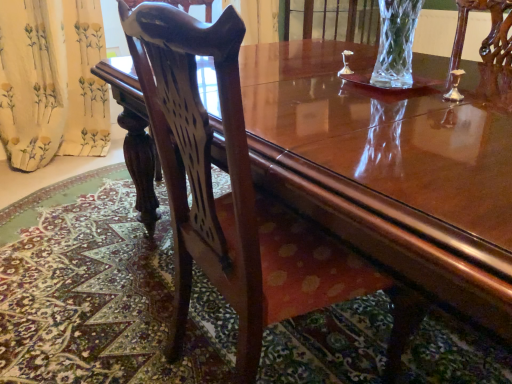
Question: Is yellow floral fabric at left bigger than mahogany wood chair at center?

Choices:
 (A) no
 (B) yes

Answer: (A)

Question: Does yellow floral fabric at left lie in front of mahogany wood chair at center?

Choices:
 (A) yes
 (B) no

Answer: (B)

Question: Considering the relative sizes of yellow floral fabric at left and mahogany wood chair at center in the image provided, is yellow floral fabric at left thinner than mahogany wood chair at center?

Choices:
 (A) no
 (B) yes

Answer: (B)

Question: Is yellow floral fabric at left positioned far away from mahogany wood chair at center?

Choices:
 (A) yes
 (B) no

Answer: (A)

Question: Is the depth of yellow floral fabric at left greater than that of mahogany wood chair at center?

Choices:
 (A) no
 (B) yes

Answer: (B)

Question: Is yellow floral fabric at left positioned with its back to mahogany wood chair at center?

Choices:
 (A) no
 (B) yes

Answer: (A)

Question: Is mahogany wood chair at center positioned behind yellow floral fabric at left?

Choices:
 (A) no
 (B) yes

Answer: (A)

Question: From a real-world perspective, is mahogany wood chair at center located higher than yellow floral fabric at left?

Choices:
 (A) yes
 (B) no

Answer: (A)

Question: From the image's perspective, is mahogany wood chair at center on top of yellow floral fabric at left?

Choices:
 (A) no
 (B) yes

Answer: (A)

Question: Are mahogany wood chair at center and yellow floral fabric at left beside each other?

Choices:
 (A) yes
 (B) no

Answer: (B)

Question: From the image's perspective, would you say mahogany wood chair at center is shown under yellow floral fabric at left?

Choices:
 (A) no
 (B) yes

Answer: (B)

Question: From a real-world perspective, is mahogany wood chair at center physically below yellow floral fabric at left?

Choices:
 (A) no
 (B) yes

Answer: (A)

Question: In terms of width, does yellow floral fabric at left look wider or thinner when compared to mahogany wood chair at center?

Choices:
 (A) thin
 (B) wide

Answer: (A)